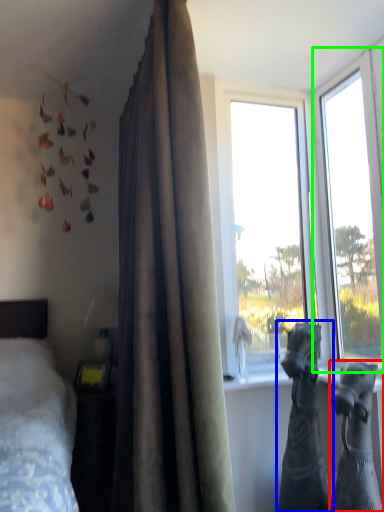
Question: Estimate the real-world distances between objects in this image. Which object is farther from animal (highlighted by a red box), animal (highlighted by a blue box) or window (highlighted by a green box)?

Choices:
 (A) animal
 (B) window

Answer: (B)